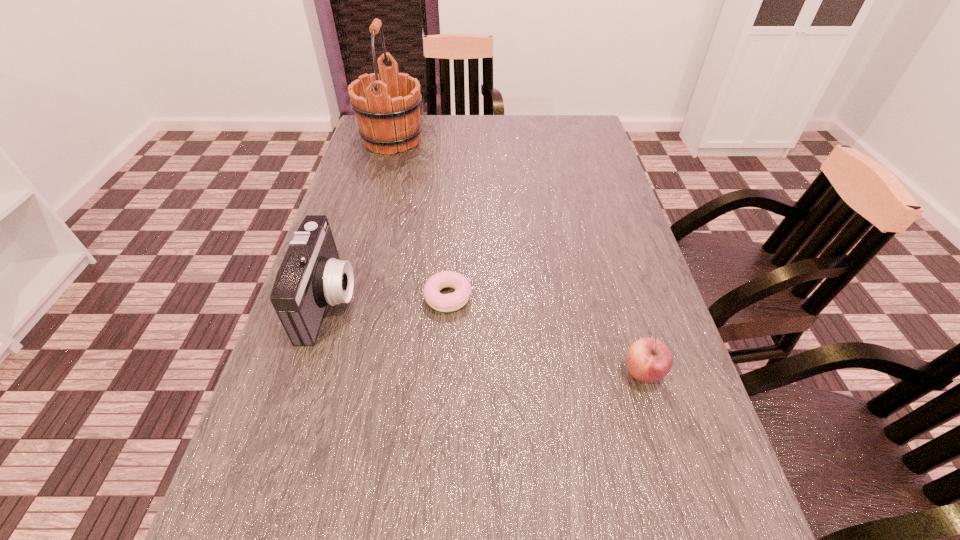
Locate an element on the screen. This screenshot has height=540, width=960. the tallest object is located at coordinates (387, 104).

You are a GUI agent. You are given a task and a screenshot of the screen. Output one action in this format:
    pyautogui.click(x=<x>, y=<y>)
    Task: Click on the wine bucket
    The image size is (960, 540).
    Given the screenshot: What is the action you would take?
    pyautogui.click(x=387, y=104)

Image resolution: width=960 pixels, height=540 pixels. I want to click on camcorder, so click(311, 276).

I want to click on apple, so click(x=648, y=360).

Locate an element on the screen. the second shortest object is located at coordinates (648, 360).

Locate an element on the screen. Image resolution: width=960 pixels, height=540 pixels. the shortest object is located at coordinates (450, 302).

Where is `doughnut`? This screenshot has width=960, height=540. doughnut is located at coordinates (450, 302).

You are a GUI agent. You are given a task and a screenshot of the screen. Output one action in this format:
    pyautogui.click(x=<x>, y=<y>)
    Task: Click on the free space located 0.390m on the front of the tallest object
    The image size is (960, 540).
    Given the screenshot: What is the action you would take?
    pyautogui.click(x=364, y=246)

Find the location of `vacant space situated 0.130m on the lens of the camcorder`. vacant space situated 0.130m on the lens of the camcorder is located at coordinates (414, 300).

This screenshot has height=540, width=960. Find the location of `vacant space positioned 0.270m on the left of the nearest object`. vacant space positioned 0.270m on the left of the nearest object is located at coordinates (478, 373).